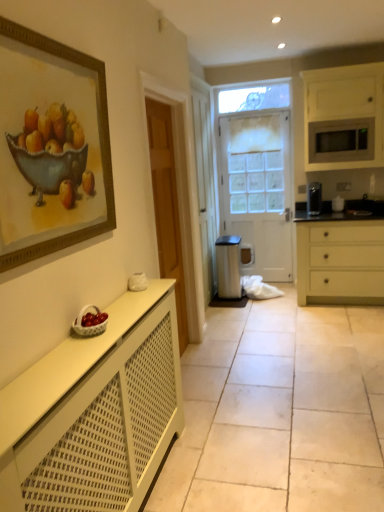
Question: Is black matte sink at right to the right of matte silver microwave at upper right from the viewer's perspective?

Choices:
 (A) yes
 (B) no

Answer: (A)

Question: Does black matte sink at right have a greater height compared to matte silver microwave at upper right?

Choices:
 (A) yes
 (B) no

Answer: (B)

Question: Is black matte sink at right positioned before matte silver microwave at upper right?

Choices:
 (A) no
 (B) yes

Answer: (A)

Question: Considering the relative sizes of black matte sink at right and matte silver microwave at upper right in the image provided, is black matte sink at right wider than matte silver microwave at upper right?

Choices:
 (A) no
 (B) yes

Answer: (A)

Question: Is black matte sink at right oriented away from matte silver microwave at upper right?

Choices:
 (A) yes
 (B) no

Answer: (B)

Question: Can you confirm if black matte sink at right is thinner than matte silver microwave at upper right?

Choices:
 (A) no
 (B) yes

Answer: (B)

Question: Is gold-framed print at upper left outside white matte microwave at upper right, the 2th cabinetry from the front?

Choices:
 (A) yes
 (B) no

Answer: (A)

Question: From the image's perspective, is gold-framed print at upper left on top of white matte microwave at upper right, the 2th cabinetry from the front?

Choices:
 (A) yes
 (B) no

Answer: (B)

Question: Can you confirm if gold-framed print at upper left is taller than white matte microwave at upper right, the 1th cabinetry viewed from the top?

Choices:
 (A) no
 (B) yes

Answer: (A)

Question: Does gold-framed print at upper left lie in front of white matte microwave at upper right, acting as the 1th cabinetry starting from the right?

Choices:
 (A) no
 (B) yes

Answer: (B)

Question: Can you confirm if gold-framed print at upper left is positioned to the right of white matte microwave at upper right, the 2th cabinetry from the front?

Choices:
 (A) no
 (B) yes

Answer: (A)

Question: Is gold-framed print at upper left shorter than white matte microwave at upper right, which is the 2th cabinetry from bottom to top?

Choices:
 (A) no
 (B) yes

Answer: (B)

Question: Considering the relative sizes of white matte microwave at upper right, the second cabinetry when ordered from left to right, and white frosted glass door at center in the image provided, is white matte microwave at upper right, the second cabinetry when ordered from left to right, thinner than white frosted glass door at center?

Choices:
 (A) yes
 (B) no

Answer: (B)